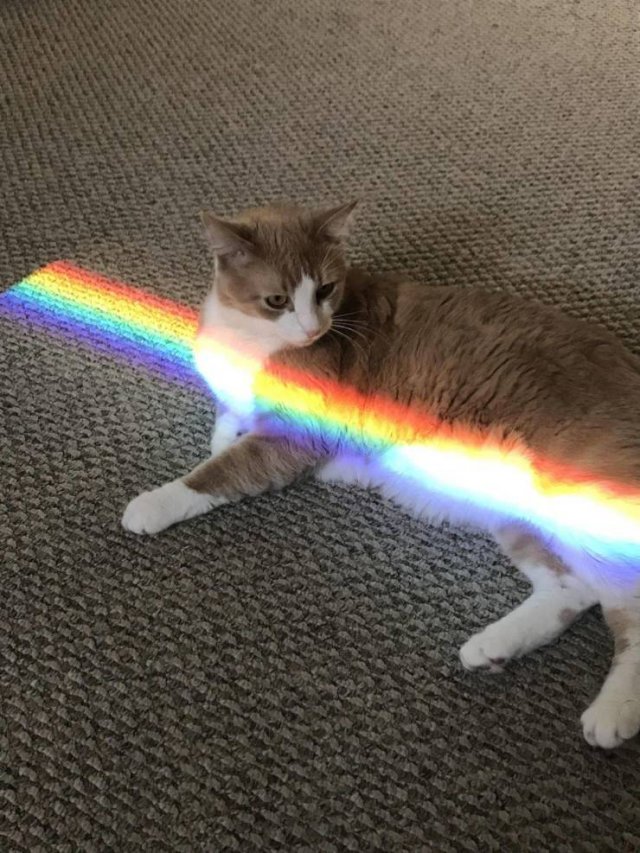
Identify the location of rainbow pattern on carpet. (102, 316).